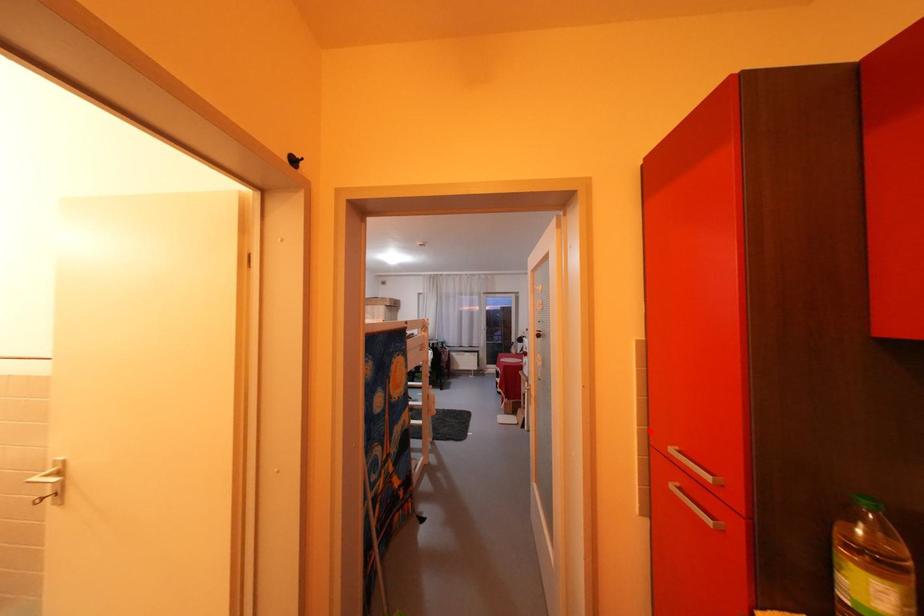
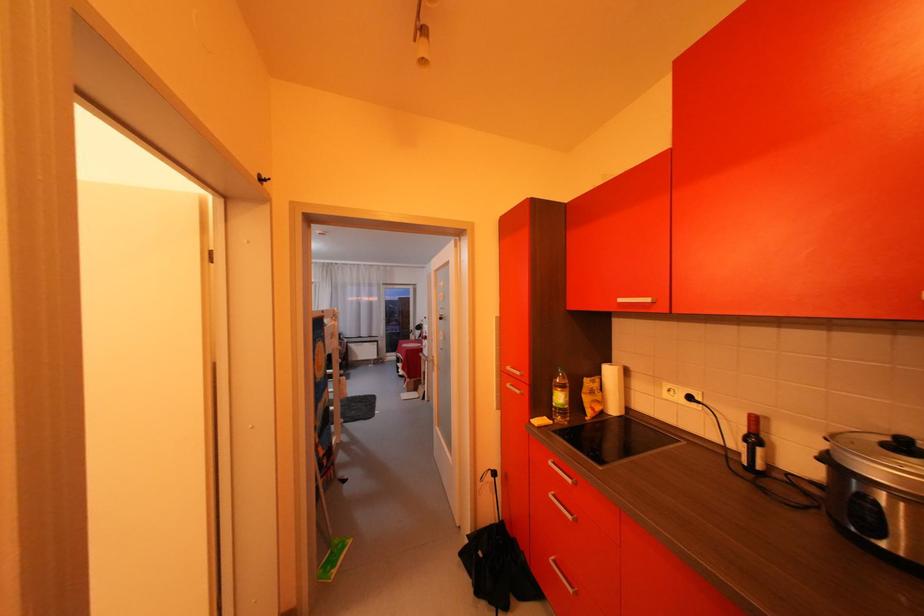
Find the pixel in the second image that matches the highlighted location in the first image.

(506, 366)